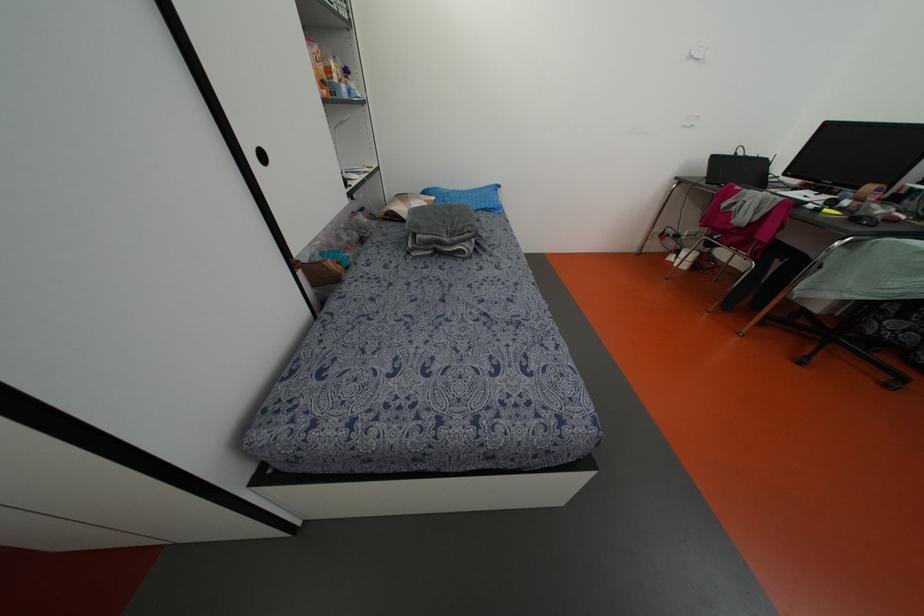
In order to click on black bag handle in this screenshot , I will do `click(740, 152)`.